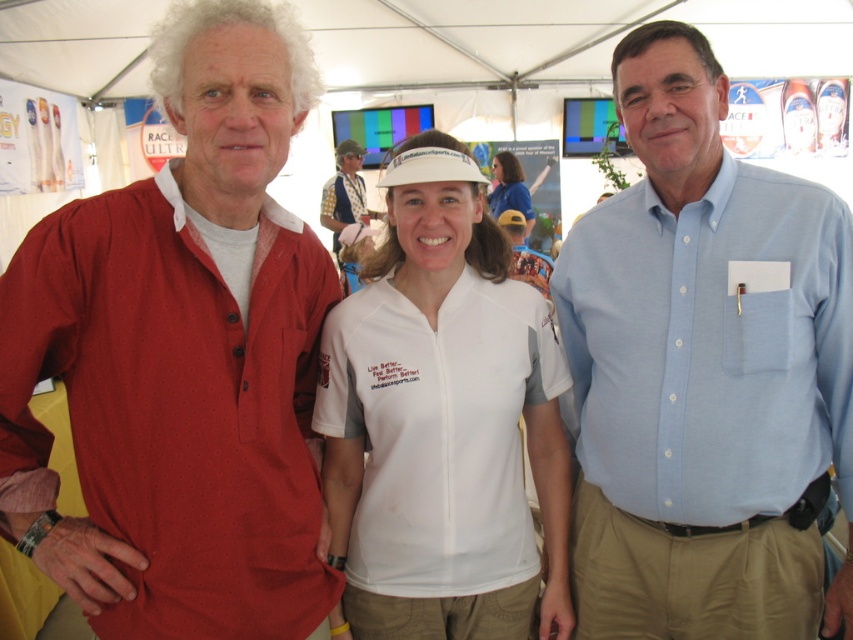
You are at a sports event and need to identify clothing items. Which item is smaller between the light blue cotton shirt at center and the white matte visor at center?

The light blue cotton shirt at center is smaller than the white matte visor at center according to the description.

You are a photographer at the event and need to capture a photo of both the matte red shirt at center and the white fabric visor at center. Which object should you focus on first if you want to ensure both are in frame without moving the camera?

The matte red shirt at center is positioned on the left side of the white fabric visor at center, so focusing on the matte red shirt at center first will ensure both objects remain in frame as the visor is to its right.